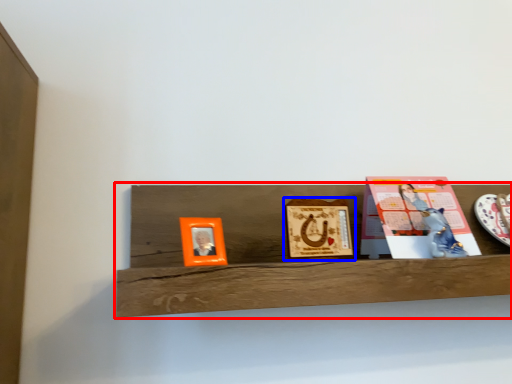
Question: Which object appears farthest to the camera in this image, shelf (highlighted by a red box) or picture frame (highlighted by a blue box)?

Choices:
 (A) shelf
 (B) picture frame

Answer: (B)